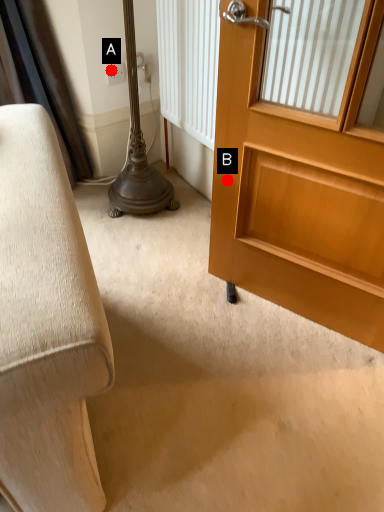
Question: Two points are circled on the image, labeled by A and B beside each circle. Which point is farther to the camera?

Choices:
 (A) A is further
 (B) B is further

Answer: (A)